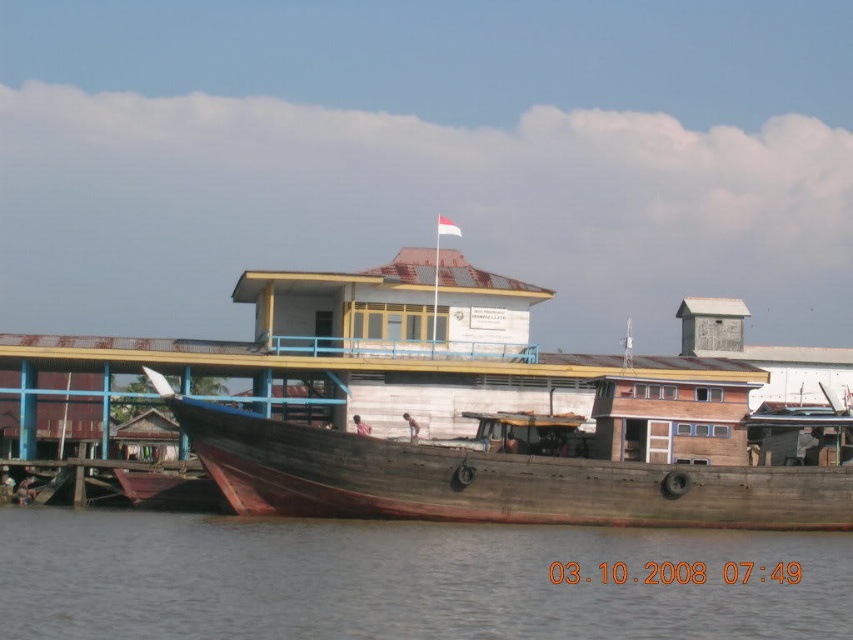
Can you confirm if brown water at lower center is positioned below wooden boat at center?

Correct, brown water at lower center is located below wooden boat at center.

Which is above, brown water at lower center or wooden boat at center?

Positioned higher is wooden boat at center.

Does point (123, 570) come in front of point (613, 500)?

Yes.

Locate an element on the screen. This screenshot has width=853, height=640. brown water at lower center is located at coordinates (396, 580).